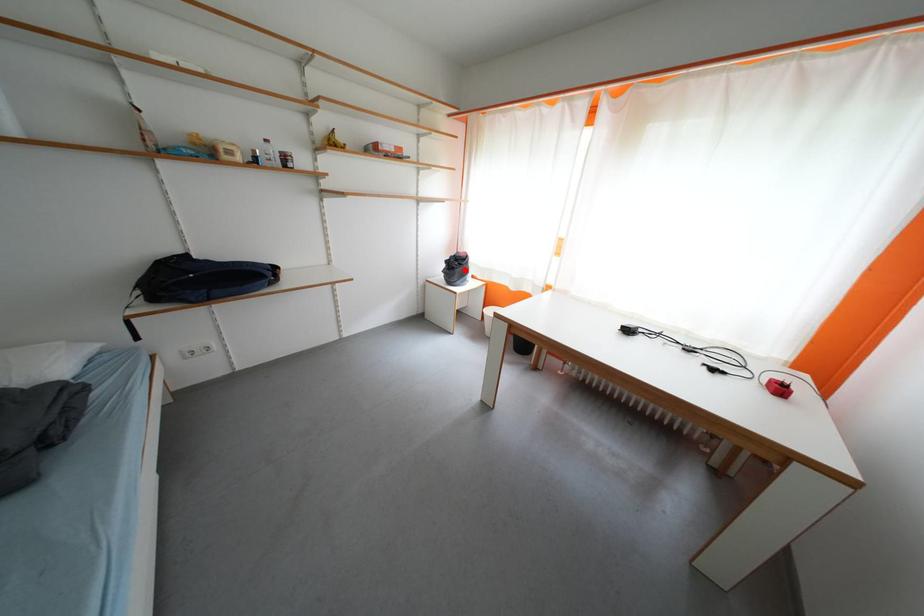
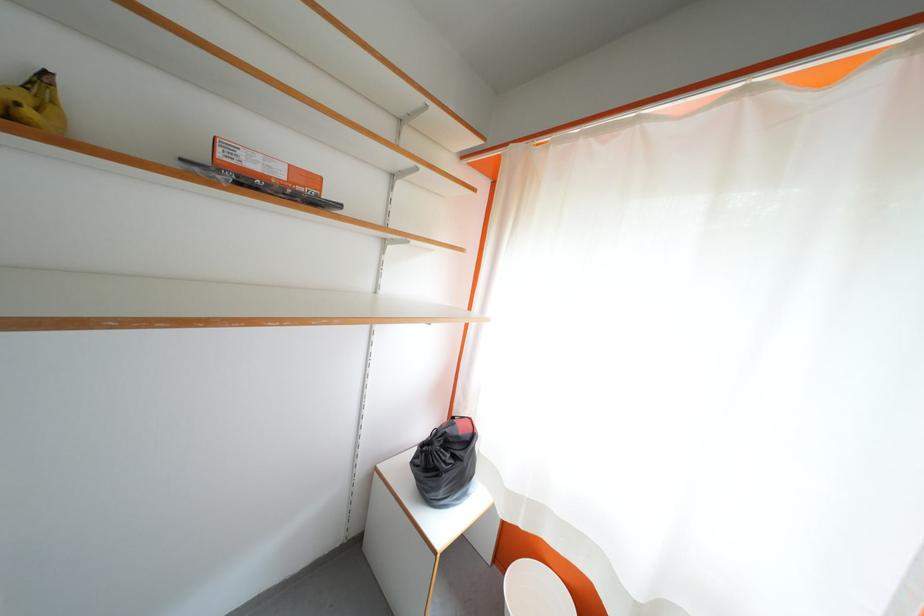
Locate, in the second image, the point that corresponds to the highlighted location in the first image.

(455, 460)